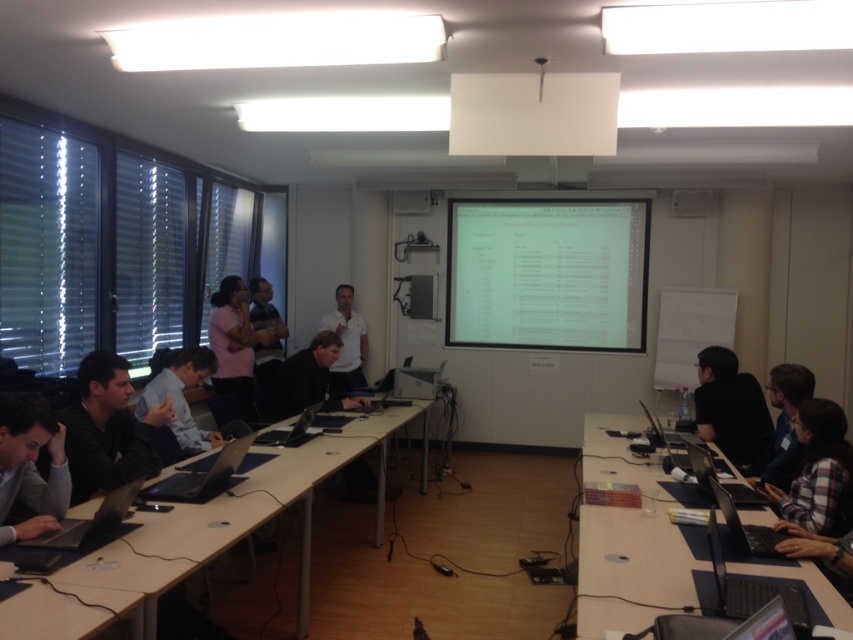
Question: Based on their relative distances, which object is nearer to the black shirt at right?

Choices:
 (A) black plastic table at lower right
 (B) gray fabric shirt at lower left
 (C) black plastic laptop at center

Answer: (A)

Question: Is plaid shirt at lower right to the left of black matte laptop at lower right from the viewer's perspective?

Choices:
 (A) no
 (B) yes

Answer: (A)

Question: Which point is closer to the camera taking this photo?

Choices:
 (A) (222, 372)
 (B) (111, 522)
 (C) (305, 403)
 (D) (358, 364)

Answer: (B)

Question: Considering the relative positions of plaid shirt at right and silver metallic laptop at center in the image provided, where is plaid shirt at right located with respect to silver metallic laptop at center?

Choices:
 (A) above
 (B) below

Answer: (A)

Question: Which object appears farthest from the camera in this image?

Choices:
 (A) black plastic laptop at right
 (B) black matte laptop at lower right

Answer: (A)

Question: Does gray fabric shirt at lower left appear under black plastic laptop at right?

Choices:
 (A) no
 (B) yes

Answer: (A)